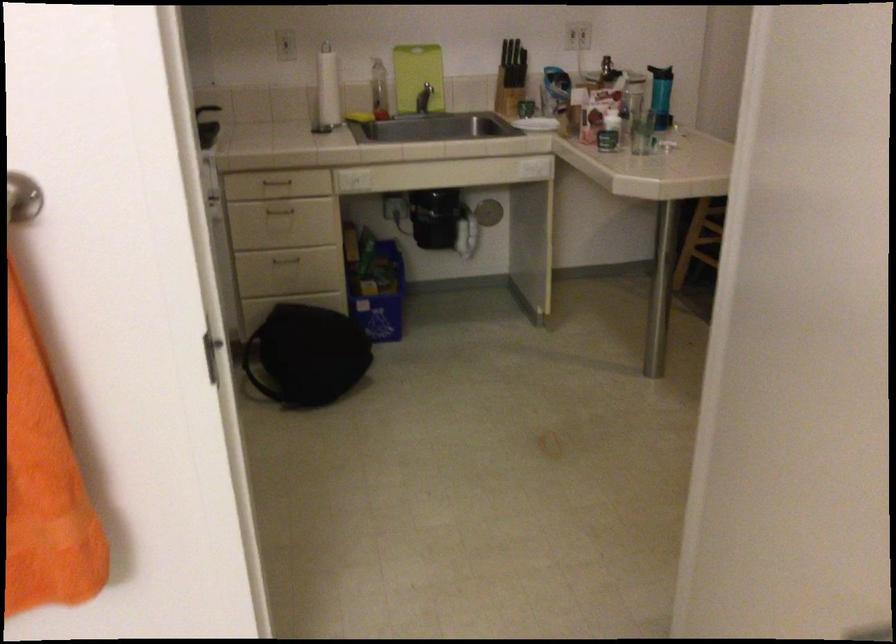
Find where to turn the silver door handle. Please return your answer as a coordinate pair (x, y).

(22, 198)